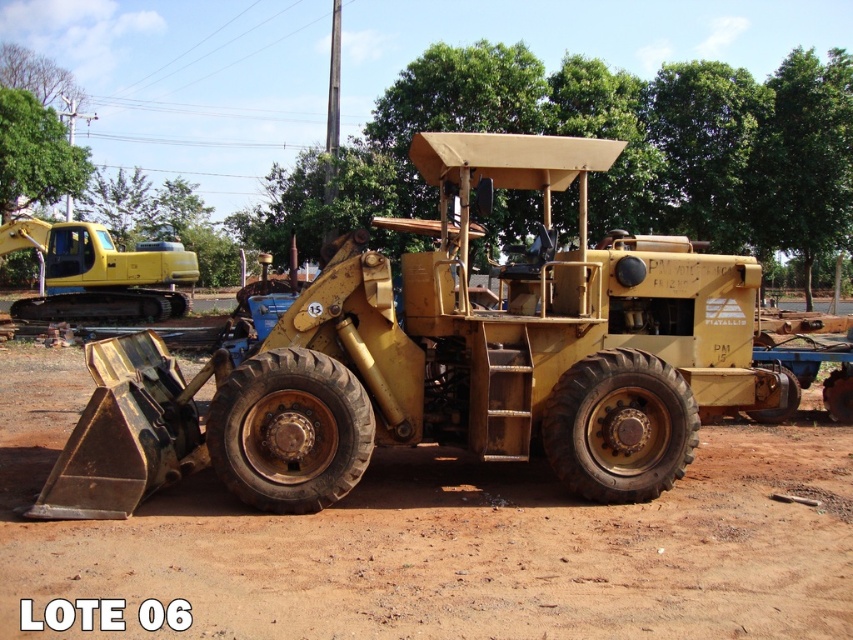
You are standing in front of the yellow matte tractor at center and want to walk to the yellow rubber tracked tractor at upper left. Which direction should you face to move towards it?

You should face towards the upper left direction to move towards the yellow rubber tracked tractor at upper left since it is located in that direction relative to the yellow matte tractor at center.

You are standing on the brown dirt field at center and want to board the yellow matte tractor at center. Which direction should you move to reach the tractor?

The yellow matte tractor at center is located above the brown dirt field at center, so you should move upward to reach it.